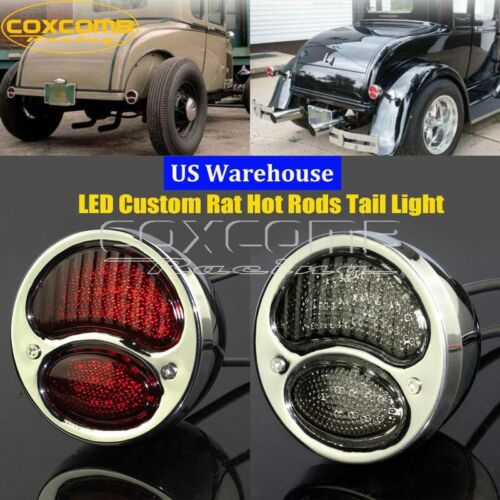
Identify the location of photographs. (140, 129), (301, 127), (172, 333), (342, 326).